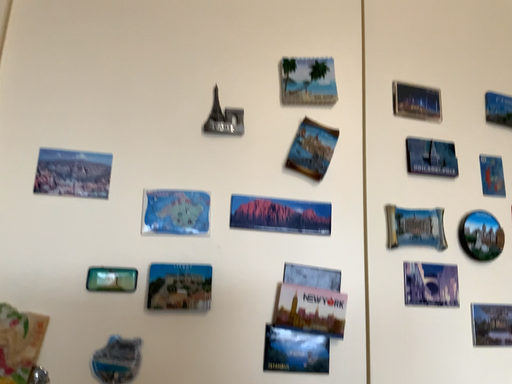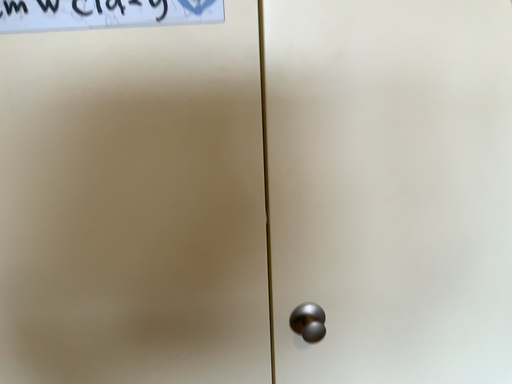
Question: Which way did the camera rotate in the video?

Choices:
 (A) rotated downward
 (B) rotated upward

Answer: (A)